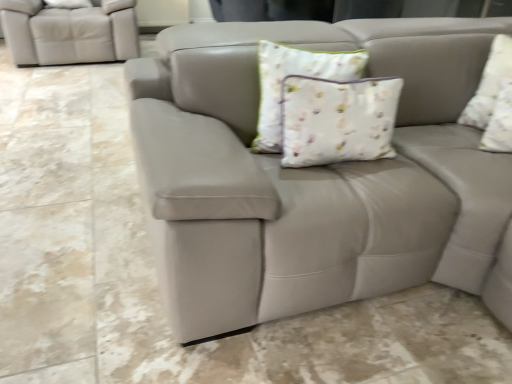
Locate an element on the screen. The image size is (512, 384). white floral fabric pillow at upper right, arranged as the first pillow when viewed from the right is located at coordinates (490, 84).

Looking at their sizes, would you say white floral fabric pillow at center, which is the 1th pillow from left to right, is wider or thinner than matte leather couch at center?

In the image, white floral fabric pillow at center, which is the 1th pillow from left to right, appears to be more narrow than matte leather couch at center.

Which object is closer to the camera, white floral fabric pillow at center, which is the 1th pillow from left to right, or matte leather couch at center?

matte leather couch at center.

Based on the photo, is white floral fabric pillow at center, which is the 1th pillow from left to right, aimed at matte leather couch at center?

No, white floral fabric pillow at center, which is the 1th pillow from left to right, is not aimed at matte leather couch at center.

You are a GUI agent. You are given a task and a screenshot of the screen. Output one action in this format:
    pyautogui.click(x=<x>, y=<y>)
    Task: Click on the 1st pillow behind the matte leather couch at center
    This screenshot has width=512, height=384.
    Given the screenshot: What is the action you would take?
    pyautogui.click(x=337, y=119)

In terms of width, does white floral fabric pillow at upper right, the 2th pillow viewed from the left, look wider or thinner when compared to matte leather couch at center?

white floral fabric pillow at upper right, the 2th pillow viewed from the left, is thinner than matte leather couch at center.

How far apart are white floral fabric pillow at upper right, arranged as the first pillow when viewed from the right, and matte leather couch at center?

A distance of 25.21 inches exists between white floral fabric pillow at upper right, arranged as the first pillow when viewed from the right, and matte leather couch at center.

Looking at this image, from the image's perspective, does white floral fabric pillow at upper right, arranged as the first pillow when viewed from the right, appear higher than matte leather couch at center?

Incorrect, from the image's perspective, white floral fabric pillow at upper right, arranged as the first pillow when viewed from the right, is lower than matte leather couch at center.

Is white floral fabric pillow at upper right, the 2th pillow viewed from the left, positioned with its back to matte leather couch at center?

That's not correct — white floral fabric pillow at upper right, the 2th pillow viewed from the left, is not looking away from matte leather couch at center.

From a real-world perspective, is matte leather couch at center physically located above or below white floral fabric pillow at upper right, the 2th pillow viewed from the left?

matte leather couch at center is below white floral fabric pillow at upper right, the 2th pillow viewed from the left.

Considering the sizes of objects matte leather couch at center and white floral fabric pillow at upper right, the 2th pillow viewed from the left, in the image provided, who is shorter, matte leather couch at center or white floral fabric pillow at upper right, the 2th pillow viewed from the left,?

matte leather couch at center.

Would you say matte leather couch at center is a long distance from white floral fabric pillow at upper right, the 2th pillow viewed from the left?

No, matte leather couch at center is not far away from white floral fabric pillow at upper right, the 2th pillow viewed from the left.

From the image's perspective, does matte leather couch at center appear lower than white floral fabric pillow at upper right, the 2th pillow viewed from the left?

No.

Considering the sizes of white floral fabric pillow at upper right, arranged as the first pillow when viewed from the right, and white floral fabric pillow at center, the second pillow viewed from the right, in the image, is white floral fabric pillow at upper right, arranged as the first pillow when viewed from the right, wider or thinner than white floral fabric pillow at center, the second pillow viewed from the right,?

white floral fabric pillow at upper right, arranged as the first pillow when viewed from the right, is wider than white floral fabric pillow at center, the second pillow viewed from the right.

Is white floral fabric pillow at upper right, arranged as the first pillow when viewed from the right, inside the boundaries of white floral fabric pillow at center, which is the 1th pillow from left to right, or outside?

white floral fabric pillow at upper right, arranged as the first pillow when viewed from the right, lies outside white floral fabric pillow at center, which is the 1th pillow from left to right.

Is point (493, 74) positioned in front of point (333, 111)?

No, it is behind (333, 111).

In the image, is white floral fabric pillow at center, the second pillow viewed from the right, on the left side or the right side of white floral fabric pillow at upper right, arranged as the first pillow when viewed from the right?

white floral fabric pillow at center, the second pillow viewed from the right, is to the left of white floral fabric pillow at upper right, arranged as the first pillow when viewed from the right.

In the scene shown: Is white floral fabric pillow at center, the second pillow viewed from the right, inside the boundaries of white floral fabric pillow at upper right, arranged as the first pillow when viewed from the right, or outside?

white floral fabric pillow at center, the second pillow viewed from the right, is spatially situated outside white floral fabric pillow at upper right, arranged as the first pillow when viewed from the right.

Is white floral fabric pillow at center, the second pillow viewed from the right, looking in the opposite direction of white floral fabric pillow at upper right, the 2th pillow viewed from the left?

white floral fabric pillow at center, the second pillow viewed from the right, does not have its back to white floral fabric pillow at upper right, the 2th pillow viewed from the left.

From the picture: From the image's perspective, is white floral fabric pillow at center, the second pillow viewed from the right, above white floral fabric pillow at upper right, arranged as the first pillow when viewed from the right?

No, from the image's perspective, white floral fabric pillow at center, the second pillow viewed from the right, is not over white floral fabric pillow at upper right, arranged as the first pillow when viewed from the right.

Is point (325, 172) closer or farther from the camera than point (311, 99)?

Point (325, 172).

Can you see matte leather couch at center touching white floral fabric pillow at center, which is the 1th pillow from left to right?

matte leather couch at center is not next to white floral fabric pillow at center, which is the 1th pillow from left to right, and they're not touching.

From a real-world perspective, which object stands above the other?

white floral fabric pillow at center, the second pillow viewed from the right, is physically above.

Is white floral fabric pillow at center, which is the 1th pillow from left to right, inside matte leather couch at center?

No, white floral fabric pillow at center, which is the 1th pillow from left to right, is not surrounded by matte leather couch at center.

Where is `studio couch that appears below the white floral fabric pillow at center, which is the 1th pillow from left to right (from a real-world perspective)`? The width and height of the screenshot is (512, 384). studio couch that appears below the white floral fabric pillow at center, which is the 1th pillow from left to right (from a real-world perspective) is located at coordinates (315, 177).

The width and height of the screenshot is (512, 384). What are the coordinates of `the 2nd pillow behind when counting from the matte leather couch at center` in the screenshot? It's located at (490, 84).

When comparing their distances from matte leather couch at center, does white floral fabric pillow at upper right, arranged as the first pillow when viewed from the right, or white floral fabric pillow at center, which is the 1th pillow from left to right, seem further?

white floral fabric pillow at upper right, arranged as the first pillow when viewed from the right, is further to matte leather couch at center.

Considering their positions, is white floral fabric pillow at center, the second pillow viewed from the right, positioned closer to matte leather couch at center than white floral fabric pillow at upper right, arranged as the first pillow when viewed from the right?

The object closer to matte leather couch at center is white floral fabric pillow at center, the second pillow viewed from the right.

Based on the photo, estimate the real-world distances between objects in this image. Which object is closer to white floral fabric pillow at center, the second pillow viewed from the right, matte leather couch at center or white floral fabric pillow at upper right, arranged as the first pillow when viewed from the right?

matte leather couch at center is positioned closer to the anchor white floral fabric pillow at center, the second pillow viewed from the right.

Looking at the image, which one is located further to white floral fabric pillow at upper right, arranged as the first pillow when viewed from the right, white floral fabric pillow at center, which is the 1th pillow from left to right, or matte leather couch at center?

The object further to white floral fabric pillow at upper right, arranged as the first pillow when viewed from the right, is white floral fabric pillow at center, which is the 1th pillow from left to right.

Which object lies further to the anchor point white floral fabric pillow at center, which is the 1th pillow from left to right, white floral fabric pillow at upper right, the 2th pillow viewed from the left, or matte leather couch at center?

white floral fabric pillow at upper right, the 2th pillow viewed from the left, is further to white floral fabric pillow at center, which is the 1th pillow from left to right.

Based on their spatial positions, is matte leather couch at center or white floral fabric pillow at center, which is the 1th pillow from left to right, closer to white floral fabric pillow at upper right, arranged as the first pillow when viewed from the right?

Based on the image, matte leather couch at center appears to be nearer to white floral fabric pillow at upper right, arranged as the first pillow when viewed from the right.

This screenshot has height=384, width=512. Find the location of `pillow situated between matte leather couch at center and white floral fabric pillow at upper right, arranged as the first pillow when viewed from the right, from left to right`. pillow situated between matte leather couch at center and white floral fabric pillow at upper right, arranged as the first pillow when viewed from the right, from left to right is located at coordinates (337, 119).